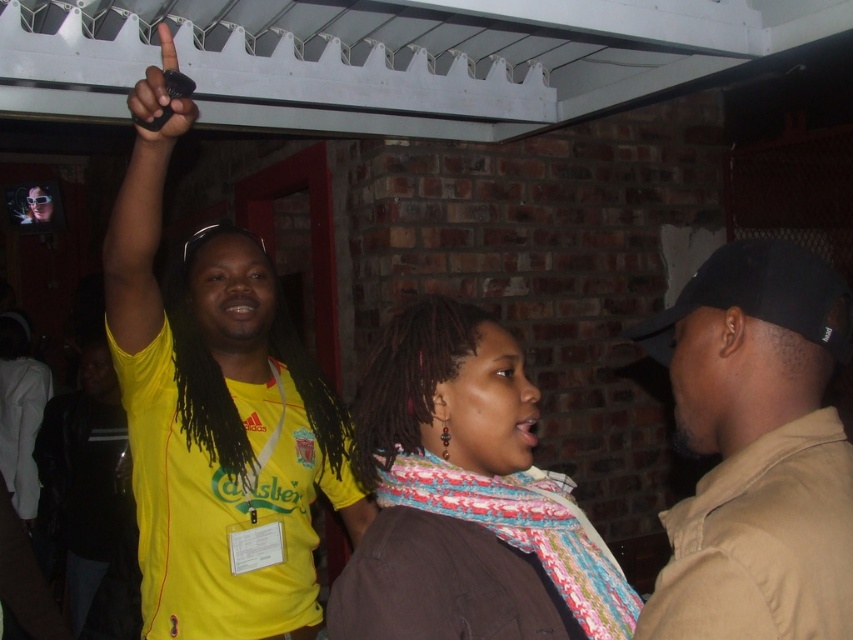
You are organizing a photo shoot and need to ensure that the black cotton cap at upper right and the black matte phone at upper left are both visible in the frame. Given their sizes, which object might require more careful framing to avoid being too large or small in the composition?

The black cotton cap at upper right is bigger than the black matte phone at upper left, so it might require more careful framing to avoid being too large in the composition.

You are at an event and want to take a photo of the black cotton cap at upper right and the black matte phone at upper left. Which object is positioned lower in the frame?

The black cotton cap at upper right is positioned below the black matte phone at upper left, so it is lower in the frame.